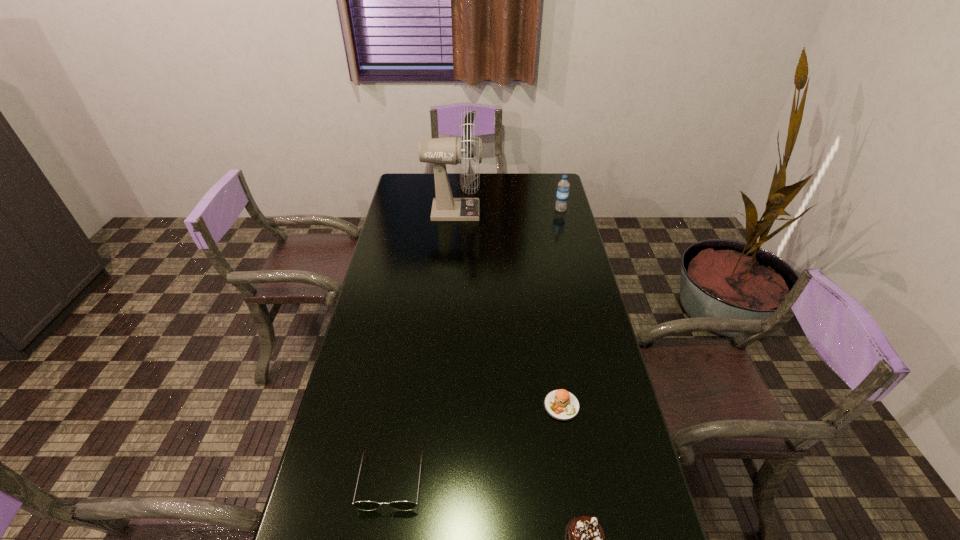
Locate an element on the screen. This screenshot has height=540, width=960. blank area at the far right corner is located at coordinates point(549,192).

What are the coordinates of `free spot between the fan and the rightmost object` in the screenshot? It's located at (507, 211).

This screenshot has width=960, height=540. Identify the location of vacant area that lies between the third nearest object and the tallest object. (508, 308).

Locate an element on the screen. blank region between the tallest object and the sunglasses is located at coordinates (422, 346).

You are a GUI agent. You are given a task and a screenshot of the screen. Output one action in this format:
    pyautogui.click(x=<x>, y=<y>)
    Task: Click on the free spot between the tallest object and the patty
    The image size is (960, 540).
    Given the screenshot: What is the action you would take?
    pyautogui.click(x=508, y=308)

The height and width of the screenshot is (540, 960). I want to click on free spot between the second nearest object and the rightmost object, so click(x=476, y=345).

Locate an element on the screen. The height and width of the screenshot is (540, 960). empty location between the fourth tallest object and the rightmost object is located at coordinates (476, 345).

Where is `vacant area that lies between the sunglasses and the tallest object`? Image resolution: width=960 pixels, height=540 pixels. vacant area that lies between the sunglasses and the tallest object is located at coordinates (422, 346).

Where is `free space that is in between the third nearest object and the fourth tallest object`? Image resolution: width=960 pixels, height=540 pixels. free space that is in between the third nearest object and the fourth tallest object is located at coordinates (476, 443).

The height and width of the screenshot is (540, 960). What are the coordinates of `object that stands as the second closest to the shortest object` in the screenshot? It's located at (361, 505).